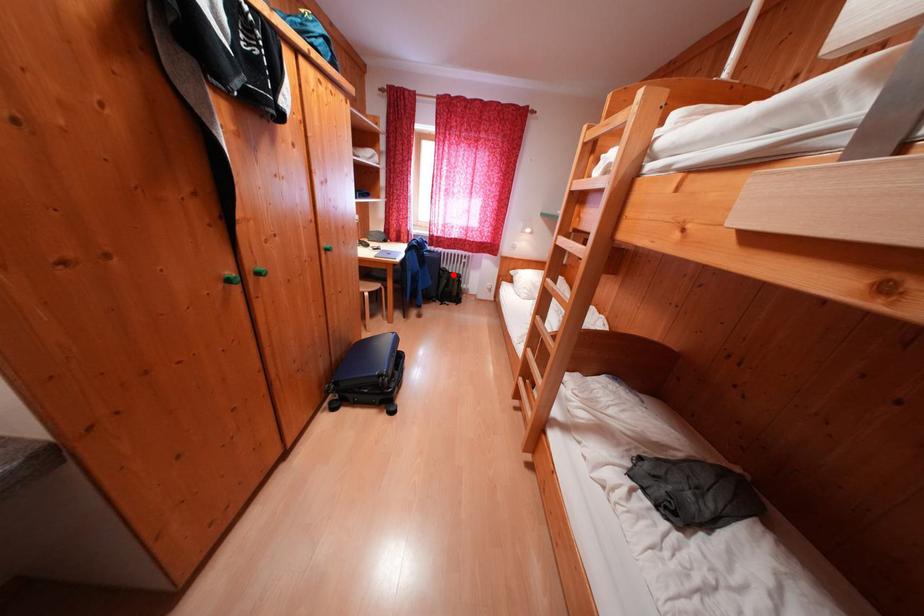
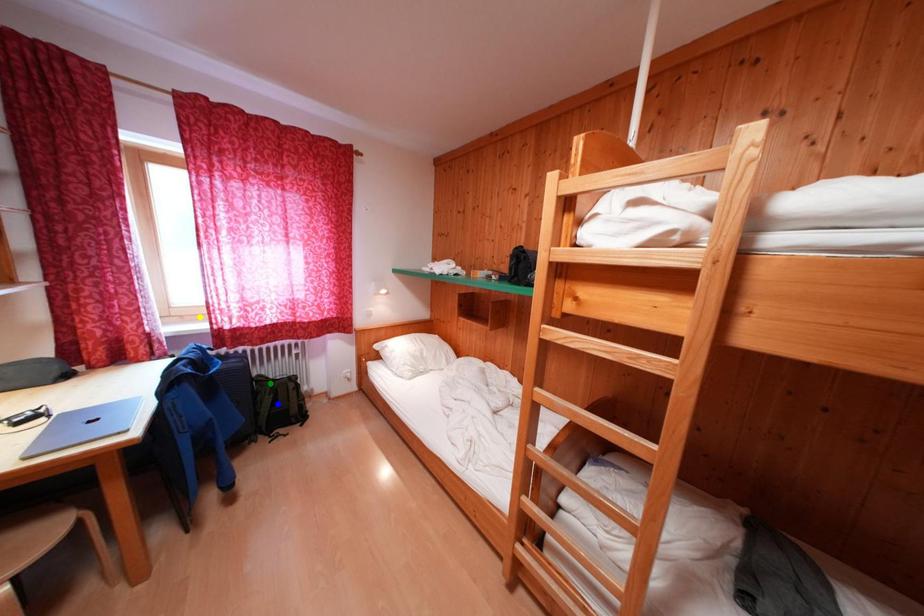
Question: I am providing you with two images of the same scene from different viewpoints. A red point is marked on the first image. You are given multiple points on the second image. Which point in image 2 represents the same 3d spot as the red point in image 1?

Choices:
 (A) yellow point
 (B) blue point
 (C) green point

Answer: (C)